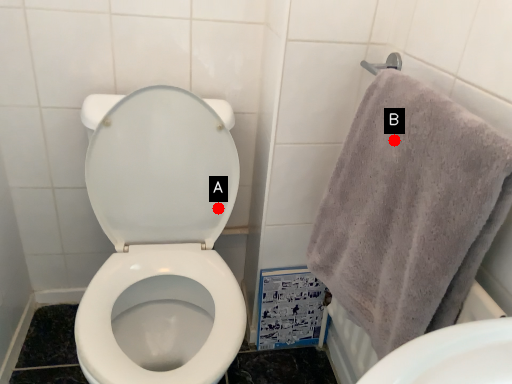
Question: Two points are circled on the image, labeled by A and B beside each circle. Which point is further to the camera?

Choices:
 (A) A is further
 (B) B is further

Answer: (A)